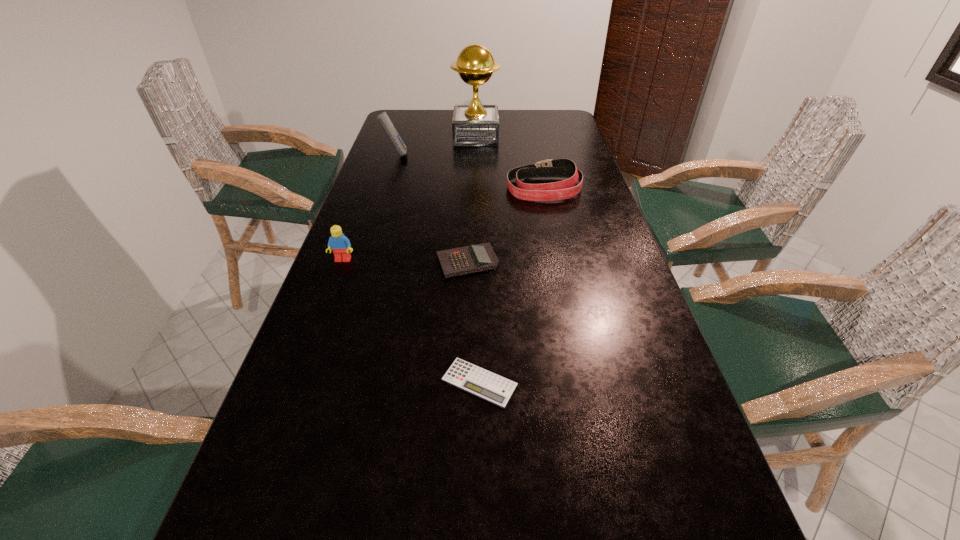
At what (x,y) coordinates should I click in order to perform the action: click on object situated at the right edge. Please return your answer as a coordinate pair (x, y). The height and width of the screenshot is (540, 960). Looking at the image, I should click on (565, 168).

The width and height of the screenshot is (960, 540). In the image, there is a desktop. Find the location of `vacant space at the far edge`. vacant space at the far edge is located at coordinates (448, 113).

This screenshot has width=960, height=540. In the image, there is a desktop. In order to click on vacant space at the left edge in this screenshot , I will do `click(414, 174)`.

Identify the location of vacant space at the right edge of the desktop. (576, 207).

Find the location of a particular element. This screenshot has width=960, height=540. free space between the fifth nearest object and the farthest object is located at coordinates (436, 146).

Where is `vacant point located between the nearest object and the fifth tallest object`? This screenshot has height=540, width=960. vacant point located between the nearest object and the fifth tallest object is located at coordinates (473, 322).

Locate an element on the screen. The width and height of the screenshot is (960, 540). free space that is in between the tallest calculator and the award is located at coordinates (436, 146).

At what (x,y) coordinates should I click in order to perform the action: click on vacant space that is in between the Lego and the tallest object. Please return your answer as a coordinate pair (x, y). This screenshot has width=960, height=540. Looking at the image, I should click on (410, 198).

Where is `free space between the Lego and the shortest calculator`? Image resolution: width=960 pixels, height=540 pixels. free space between the Lego and the shortest calculator is located at coordinates (411, 321).

Identify the location of free spot between the award and the second tallest calculator. (471, 199).